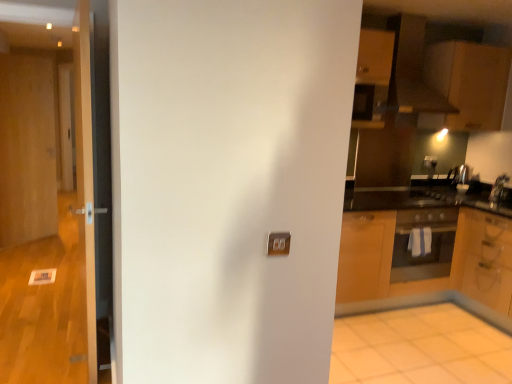
Question: Does matte black oven at right turn towards wooden door at left, which ranks as the 2th door in back-to-front order?

Choices:
 (A) yes
 (B) no

Answer: (B)

Question: Does matte black oven at right have a greater width compared to wooden door at left, which ranks as the 2th door in back-to-front order?

Choices:
 (A) no
 (B) yes

Answer: (B)

Question: Is matte black oven at right far from wooden door at left, which ranks as the 2th door in back-to-front order?

Choices:
 (A) yes
 (B) no

Answer: (A)

Question: Considering the relative sizes of matte black oven at right and wooden door at left, the 2th door positioned from the left, in the image provided, is matte black oven at right smaller than wooden door at left, the 2th door positioned from the left,?

Choices:
 (A) yes
 (B) no

Answer: (A)

Question: From the image's perspective, is matte black oven at right over wooden door at left, the 2th door positioned from the left?

Choices:
 (A) yes
 (B) no

Answer: (B)

Question: From the image's perspective, would you say matte black oven at right is shown under wooden door at left, the 2th door positioned from the left?

Choices:
 (A) yes
 (B) no

Answer: (A)

Question: Considering the relative positions of wooden door at left, which ranks as the third door in front-to-back order, and matte brown exhaust hood at upper right in the image provided, is wooden door at left, which ranks as the third door in front-to-back order, to the right of matte brown exhaust hood at upper right from the viewer's perspective?

Choices:
 (A) no
 (B) yes

Answer: (A)

Question: Is wooden door at left, the 1th door from the back, at the left side of matte brown exhaust hood at upper right?

Choices:
 (A) no
 (B) yes

Answer: (B)

Question: Considering the relative sizes of wooden door at left, which ranks as the third door in front-to-back order, and matte brown exhaust hood at upper right in the image provided, is wooden door at left, which ranks as the third door in front-to-back order, taller than matte brown exhaust hood at upper right?

Choices:
 (A) yes
 (B) no

Answer: (A)

Question: From the image's perspective, is wooden door at left, which ranks as the third door in front-to-back order, under matte brown exhaust hood at upper right?

Choices:
 (A) no
 (B) yes

Answer: (B)

Question: Is wooden door at left, which is the 3th door from right to left, thinner than matte brown exhaust hood at upper right?

Choices:
 (A) no
 (B) yes

Answer: (B)

Question: Is wooden door at left, acting as the first door starting from the left, further to camera compared to matte brown exhaust hood at upper right?

Choices:
 (A) no
 (B) yes

Answer: (B)

Question: From the image's perspective, is wooden door at left, acting as the first door starting from the left, below white glossy door at left, the first door viewed from the front?

Choices:
 (A) no
 (B) yes

Answer: (A)